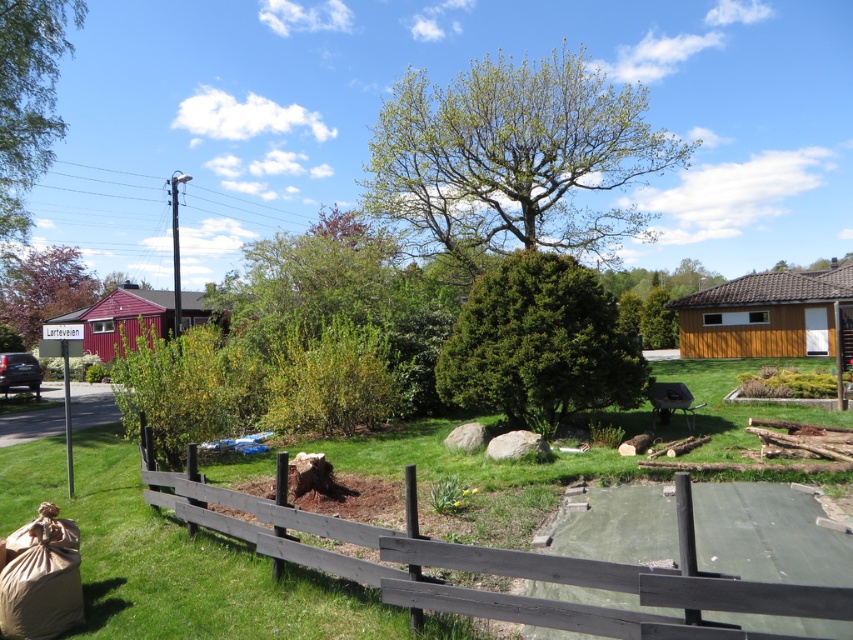
Is point (556, 602) positioned after point (86, 292)?

That is False.

Identify the location of brown wooden fence at center. (498, 566).

Where is `brown wooden fence at center`? brown wooden fence at center is located at coordinates (498, 566).

Can you confirm if green leafy tree at center is positioned below green grass at center?

No.

Who is positioned more to the right, green leafy tree at center or green grass at center?

Positioned to the right is green leafy tree at center.

This screenshot has width=853, height=640. What do you see at coordinates (512, 157) in the screenshot? I see `green leafy tree at center` at bounding box center [512, 157].

Where is `green leafy tree at center`? The width and height of the screenshot is (853, 640). green leafy tree at center is located at coordinates (512, 157).

Is green leafy tree at center bigger than green leafy tree at left?

Correct, green leafy tree at center is larger in size than green leafy tree at left.

Is green leafy tree at center thinner than green leafy tree at left?

No, green leafy tree at center is not thinner than green leafy tree at left.

Between point (527, 241) and point (0, 298), which one is positioned behind?

The point (0, 298) is behind.

In order to click on green leafy tree at center in this screenshot , I will do `click(512, 157)`.